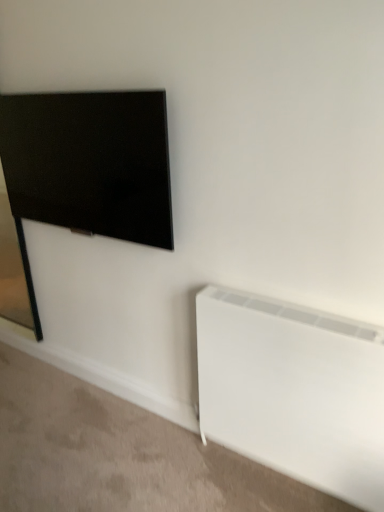
Question: From a real-world perspective, is matte black tv at upper left physically located above or below white matte radiator at lower right?

Choices:
 (A) above
 (B) below

Answer: (A)

Question: Considering the positions of matte black tv at upper left and white matte radiator at lower right in the image, is matte black tv at upper left bigger or smaller than white matte radiator at lower right?

Choices:
 (A) big
 (B) small

Answer: (B)

Question: Do you think matte black tv at upper left is within white matte radiator at lower right, or outside of it?

Choices:
 (A) outside
 (B) inside

Answer: (A)

Question: Looking at their shapes, would you say white matte radiator at lower right is wider or thinner than matte black tv at upper left?

Choices:
 (A) wide
 (B) thin

Answer: (A)

Question: Is white matte radiator at lower right spatially inside matte black tv at upper left, or outside of it?

Choices:
 (A) outside
 (B) inside

Answer: (A)

Question: Visually, is white matte radiator at lower right positioned to the left or to the right of matte black tv at upper left?

Choices:
 (A) left
 (B) right

Answer: (B)

Question: From their relative heights in the image, would you say white matte radiator at lower right is taller or shorter than matte black tv at upper left?

Choices:
 (A) short
 (B) tall

Answer: (B)